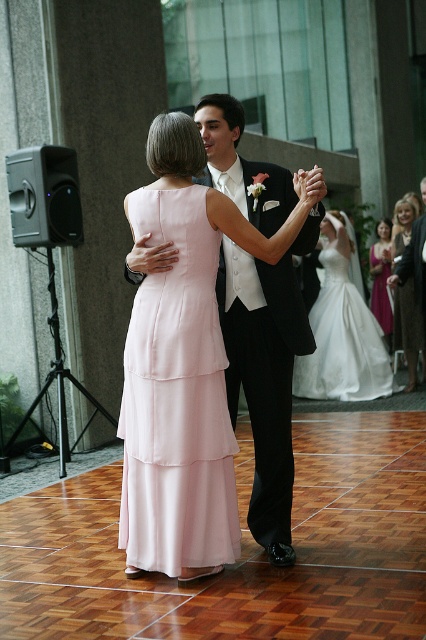
Who is taller, light pink satin dress at center or white satin tuxedo at center?

Standing taller between the two is white satin tuxedo at center.

Does light pink satin dress at center have a greater height compared to white satin tuxedo at center?

In fact, light pink satin dress at center may be shorter than white satin tuxedo at center.

You are a GUI agent. You are given a task and a screenshot of the screen. Output one action in this format:
    pyautogui.click(x=<x>, y=<y>)
    Task: Click on the light pink satin dress at center
    
    Given the screenshot: What is the action you would take?
    pyautogui.click(x=176, y=400)

Locate an element on the screen. The image size is (426, 640). light pink satin dress at center is located at coordinates (176, 400).

Who is more forward, [201,236] or [339,225]?

Positioned in front is point [201,236].

Who is higher up, light pink satin dress at center or white satin dress at center?

white satin dress at center is higher up.

Identify the location of light pink satin dress at center. The width and height of the screenshot is (426, 640). (176, 400).

Is light pink satin dress at center thinner than purple satin dress at right?

Incorrect, light pink satin dress at center's width is not less than purple satin dress at right's.

Locate an element on the screen. Image resolution: width=426 pixels, height=640 pixels. light pink satin dress at center is located at coordinates pos(176,400).

You are a GUI agent. You are given a task and a screenshot of the screen. Output one action in this format:
    pyautogui.click(x=<x>, y=<y>)
    Task: Click on the light pink satin dress at center
    The height and width of the screenshot is (640, 426).
    Given the screenshot: What is the action you would take?
    [176, 400]